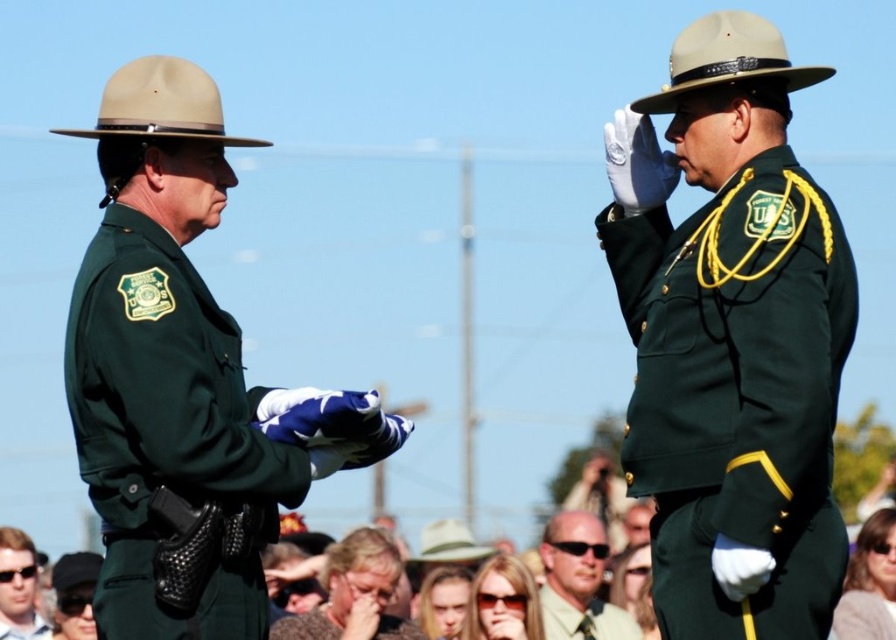
You are a photographer at the event and want to capture a photo of both the green matte uniform at right and the light brown leather sunglasses at center. Which object should you focus on first to ensure it appears larger in the photo?

The green matte uniform at right is much taller than the light brown leather sunglasses at center, so you should focus on the green matte uniform at right first to ensure it appears larger in the photo.

You are a photographer at the event. You want to take a photo of the green matte uniform at right and the light brown leather sunglasses at center. Which object will appear larger in the photo?

The green matte uniform at right is in front of the light brown leather sunglasses at center, so it will appear larger in the photo.

You are a photographer at the event and want to capture a photo of both the matte brown hair at center and the green matte uniform at center. Which one should you focus on first to ensure they are both in focus?

The matte brown hair at center is taller than the green matte uniform at center, so you should focus on the matte brown hair at center first to ensure both are in focus.